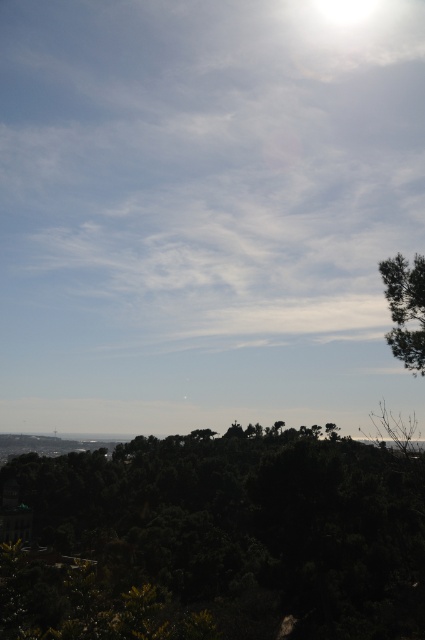
Between dark green leafy tree at center and green leafy tree at upper right, which one is positioned lower?

dark green leafy tree at center is lower down.

From the picture: Is dark green leafy tree at center behind green leafy tree at upper right?

No.

Is point (28, 477) closer to camera compared to point (401, 280)?

That is False.

The height and width of the screenshot is (640, 425). Identify the location of dark green leafy tree at center. pyautogui.click(x=226, y=536).